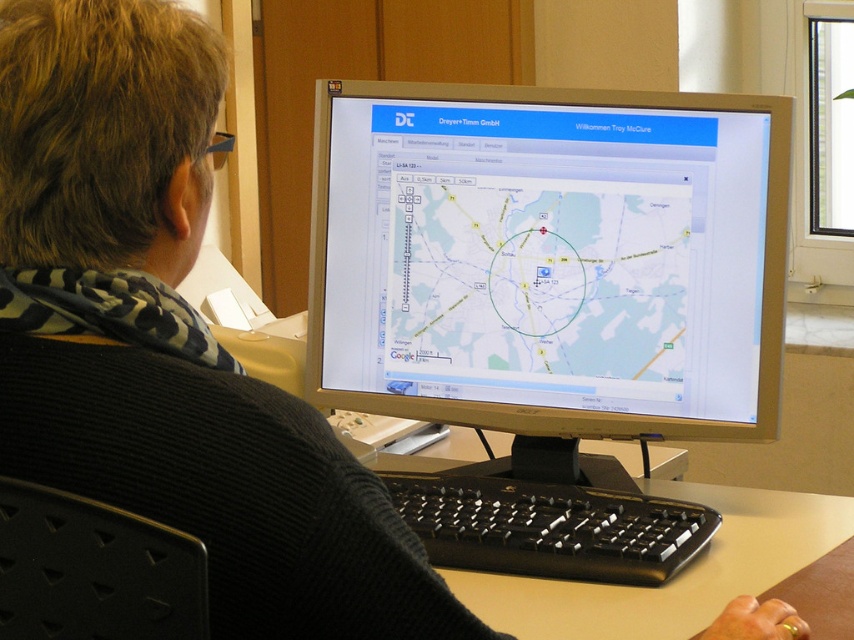
Question: Can you confirm if silver metallic monitor at center is thinner than black plastic keyboard at center?

Choices:
 (A) no
 (B) yes

Answer: (A)

Question: Based on their relative distances, which object is nearer to the silver metallic monitor at center?

Choices:
 (A) transparent map at center
 (B) black plastic keyboard at center

Answer: (A)

Question: Does silver metallic monitor at center appear on the left side of transparent map at center?

Choices:
 (A) yes
 (B) no

Answer: (B)

Question: Does silver metallic monitor at center have a larger size compared to black plastic keyboard at center?

Choices:
 (A) no
 (B) yes

Answer: (B)

Question: Which point is closer to the camera?

Choices:
 (A) silver metallic monitor at center
 (B) black plastic keyboard at center
 (C) transparent map at center

Answer: (B)

Question: Which is nearer to the silver metallic monitor at center?

Choices:
 (A) black plastic keyboard at center
 (B) transparent map at center

Answer: (B)